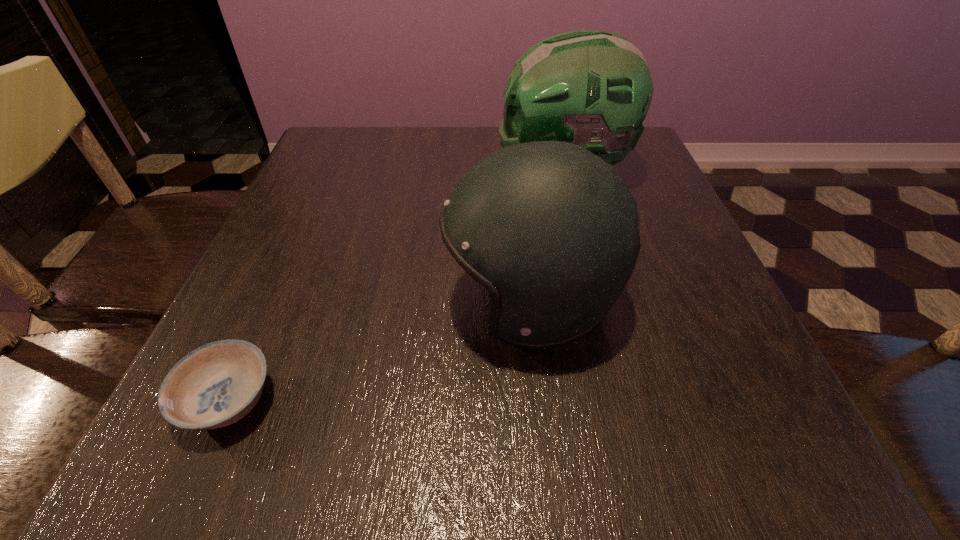
Identify the location of vacant space that's between the shortest object and the farther football helmet. (396, 286).

This screenshot has height=540, width=960. I want to click on vacant area that lies between the farther football helmet and the shortest object, so click(396, 286).

The height and width of the screenshot is (540, 960). Find the location of `free spot between the shortest object and the farthest object`. free spot between the shortest object and the farthest object is located at coordinates (396, 286).

Locate an element on the screen. Image resolution: width=960 pixels, height=540 pixels. empty space that is in between the farther football helmet and the leftmost object is located at coordinates [x=396, y=286].

Identify the location of object that stands as the second closest to the bowl. (591, 88).

Identify which object is the second nearest to the nearer football helmet. Please provide its 2D coordinates. Your answer should be formatted as a tuple, i.e. [(x, y)], where the tuple contains the x and y coordinates of a point satisfying the conditions above.

[(216, 385)]

Locate an element on the screen. The width and height of the screenshot is (960, 540). free space that satisfies the following two spatial constraints: 1. on the visor of the farthest object; 2. on the front side of the bowl is located at coordinates (619, 401).

Where is `free space that satisfies the following two spatial constraints: 1. at the face opening of the nearer football helmet; 2. on the front side of the shortest object`? free space that satisfies the following two spatial constraints: 1. at the face opening of the nearer football helmet; 2. on the front side of the shortest object is located at coordinates (541, 401).